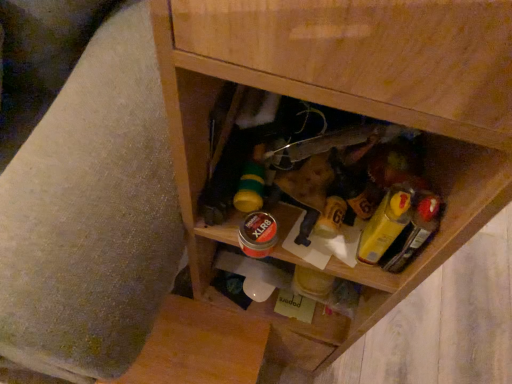
Question: From a real-world perspective, is wooden swivel chair at lower right located higher than wooden cabinet at center?

Choices:
 (A) no
 (B) yes

Answer: (A)

Question: Considering the relative positions of wooden swivel chair at lower right and wooden cabinet at center in the image provided, is wooden swivel chair at lower right to the left of wooden cabinet at center from the viewer's perspective?

Choices:
 (A) yes
 (B) no

Answer: (A)

Question: Is wooden cabinet at center completely or partially inside wooden swivel chair at lower right?

Choices:
 (A) no
 (B) yes

Answer: (A)

Question: Is wooden swivel chair at lower right not inside wooden cabinet at center?

Choices:
 (A) yes
 (B) no

Answer: (A)

Question: Considering the relative sizes of wooden swivel chair at lower right and wooden cabinet at center in the image provided, is wooden swivel chair at lower right smaller than wooden cabinet at center?

Choices:
 (A) no
 (B) yes

Answer: (A)

Question: From the image's perspective, is wooden swivel chair at lower right under wooden cabinet at center?

Choices:
 (A) yes
 (B) no

Answer: (B)

Question: Is wooden cabinet at center thinner than yellow plastic mustard at center right?

Choices:
 (A) yes
 (B) no

Answer: (B)

Question: Can you confirm if wooden cabinet at center is smaller than yellow plastic mustard at center right?

Choices:
 (A) yes
 (B) no

Answer: (B)

Question: Does wooden cabinet at center come in front of yellow plastic mustard at center right?

Choices:
 (A) no
 (B) yes

Answer: (B)

Question: From a real-world perspective, does wooden cabinet at center sit lower than yellow plastic mustard at center right?

Choices:
 (A) yes
 (B) no

Answer: (A)

Question: Is wooden cabinet at center turned away from yellow plastic mustard at center right?

Choices:
 (A) no
 (B) yes

Answer: (B)

Question: Considering the relative sizes of wooden cabinet at center and yellow plastic mustard at center right in the image provided, is wooden cabinet at center taller than yellow plastic mustard at center right?

Choices:
 (A) yes
 (B) no

Answer: (A)

Question: From the image's perspective, is yellow plastic mustard at center right located above wooden swivel chair at lower right?

Choices:
 (A) yes
 (B) no

Answer: (B)